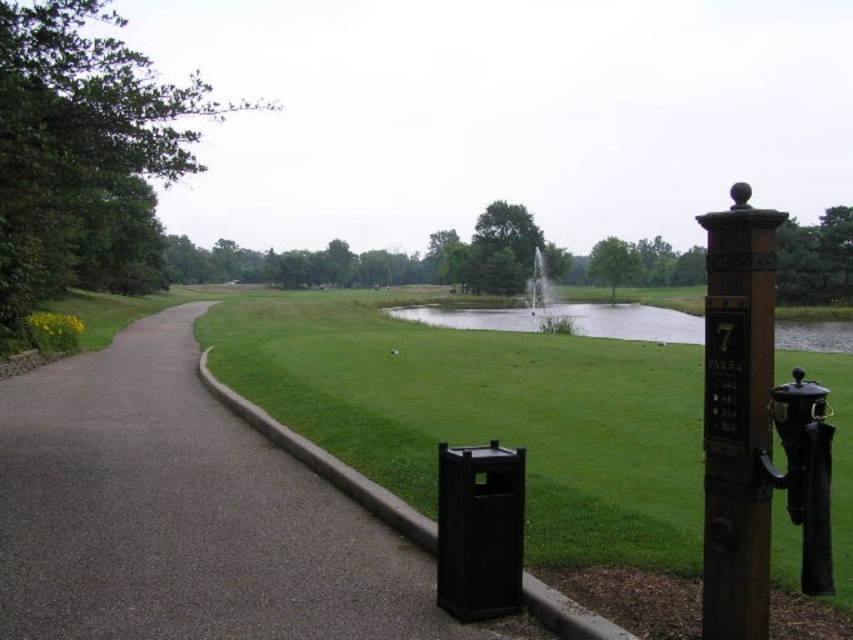
You are standing at the viewpoint of the image and want to reach the point marked as point (357, 360). If your walking speed is 1.2 meters per second, how many seconds will it take you to reach that point?

The distance between you and point (357, 360) is 16.06 meters. At a speed of 1.2 meters per second, it will take approximately 13.38 seconds to reach the point.